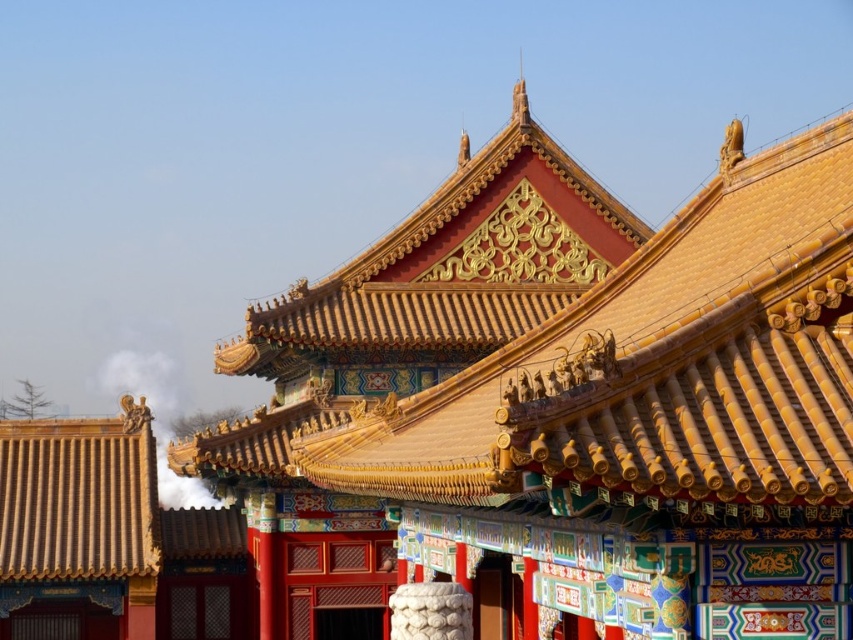
Which of these two, golden glazed tiles at center or white smoke at roof top, stands taller?

golden glazed tiles at center is taller.

Describe the element at coordinates (560, 410) in the screenshot. The image size is (853, 640). I see `golden glazed tiles at center` at that location.

You are a GUI agent. You are given a task and a screenshot of the screen. Output one action in this format:
    pyautogui.click(x=<x>, y=<y>)
    Task: Click on the golden glazed tiles at center
    Image resolution: width=853 pixels, height=640 pixels.
    Given the screenshot: What is the action you would take?
    pyautogui.click(x=560, y=410)